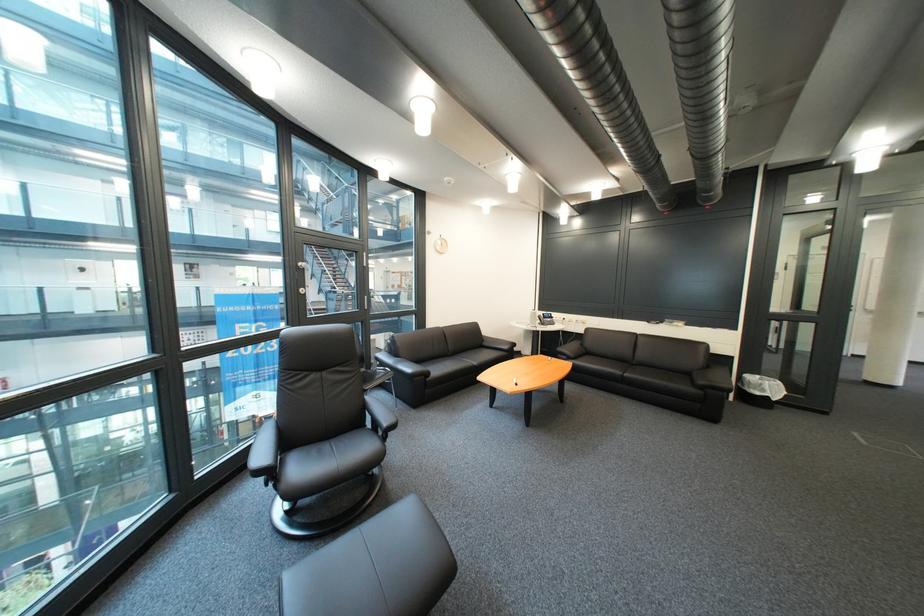
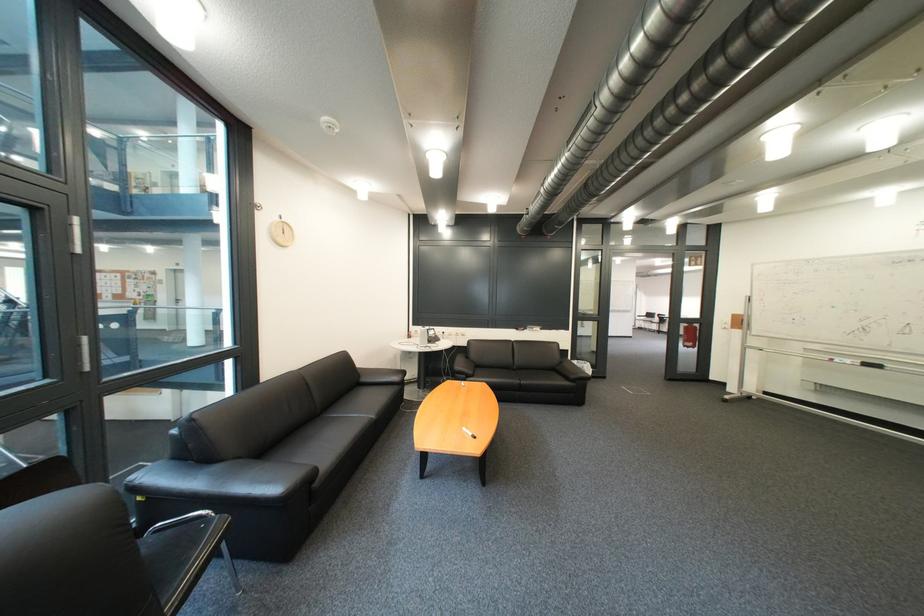
Find the pixel in the second image that matches the point at 840,415 in the first image.

(618, 379)